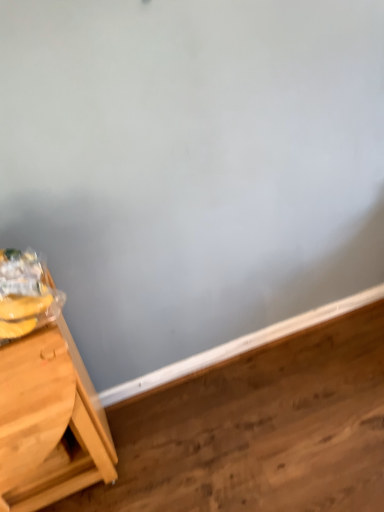
The height and width of the screenshot is (512, 384). Find the location of `empty space that is ontop of wooden at lower left (from a real-world perspective)`. empty space that is ontop of wooden at lower left (from a real-world perspective) is located at coordinates (252, 431).